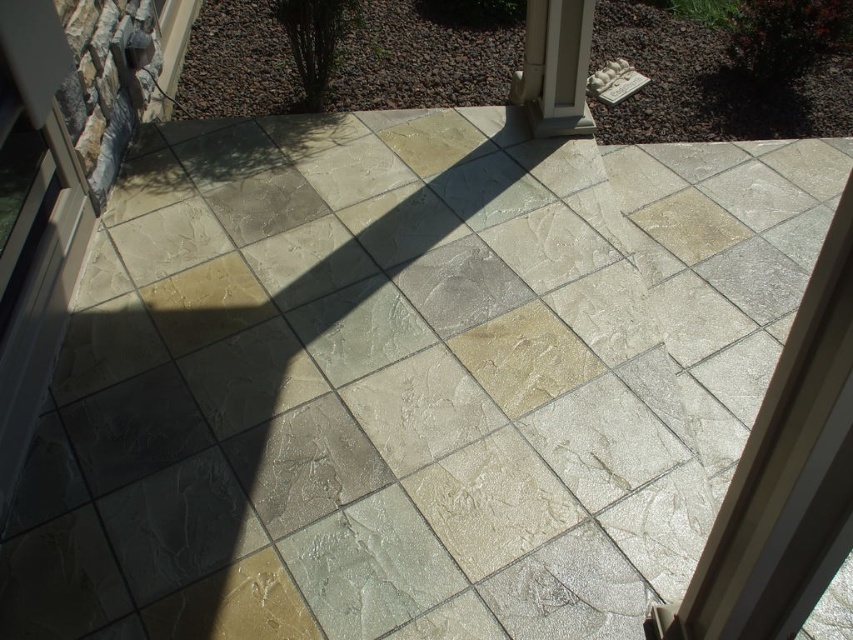
Looking at this image, you are standing inside the building looking out at the tiled patio. There are two points marked on the patio tiles. The first point is at coordinate point (59, 216) and the second is at point (577, 3). Which point is closer to you?

Point (59, 216) is closer to the viewer than point (577, 3).